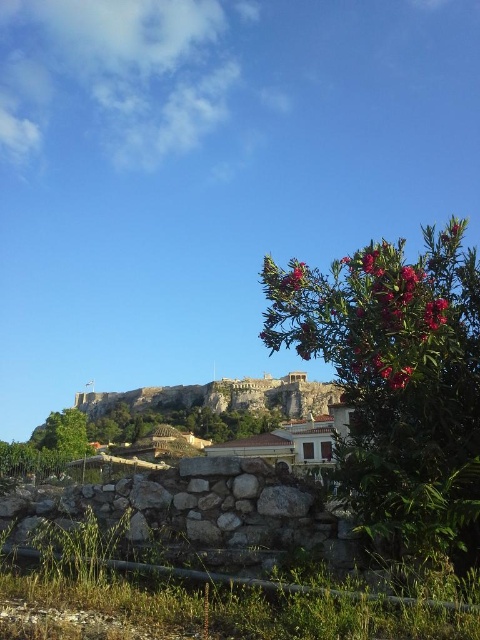
You are a visitor at this historic site and want to take a photo of the pink leafy bush at right and the pink matte flower at upper right. Which one should you focus on first if you want both to be in sharp focus?

The pink leafy bush at right is below the pink matte flower at upper right, so you should focus on the pink leafy bush at right first to ensure both are in focus.

You are a photographer planning to take a photo of the pink leafy bush at right and the pink matte flower at upper right. Which object should you focus on first if you want to capture both in the same frame without moving the camera?

The pink leafy bush at right should be focused on first because it is positioned on the left side of the pink matte flower at upper right, so adjusting focus to include both would start with the closer object.